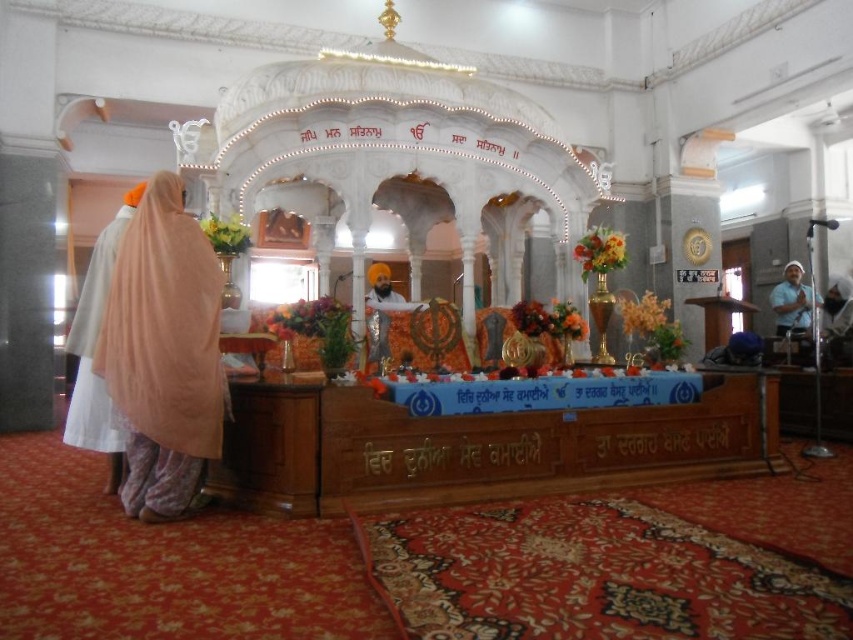
Does light peach sheer at left come behind blue fabric at right?

No, it is not.

How distant is light peach sheer at left from blue fabric at right?

light peach sheer at left is 12.15 meters from blue fabric at right.

Where is `light peach sheer at left`? The width and height of the screenshot is (853, 640). light peach sheer at left is located at coordinates (164, 353).

Is white silk robe at left wider than blue fabric at right?

Correct, the width of white silk robe at left exceeds that of blue fabric at right.

Between white silk robe at left and blue fabric at right, which one appears on the left side from the viewer's perspective?

white silk robe at left

The height and width of the screenshot is (640, 853). In order to click on white silk robe at left in this screenshot , I will do `click(93, 348)`.

Does point (152, 348) come closer to viewer compared to point (78, 412)?

Yes, point (152, 348) is in front of point (78, 412).

Does light peach sheer at left appear on the right side of white silk robe at left?

Yes, light peach sheer at left is to the right of white silk robe at left.

Locate an element on the screen. This screenshot has height=640, width=853. light peach sheer at left is located at coordinates [x=164, y=353].